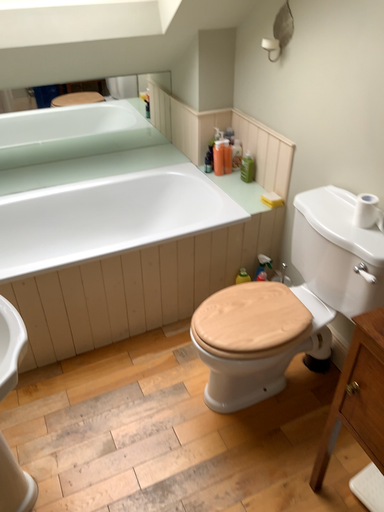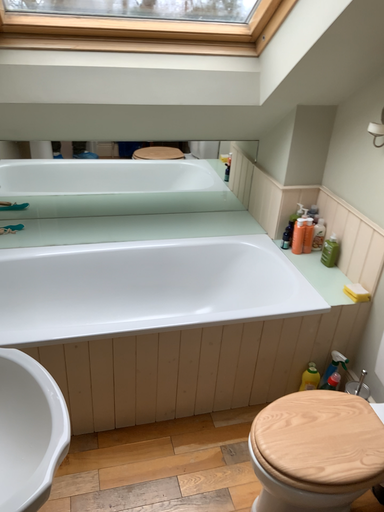
Question: Which way did the camera rotate in the video?

Choices:
 (A) rotated downward
 (B) rotated upward

Answer: (B)